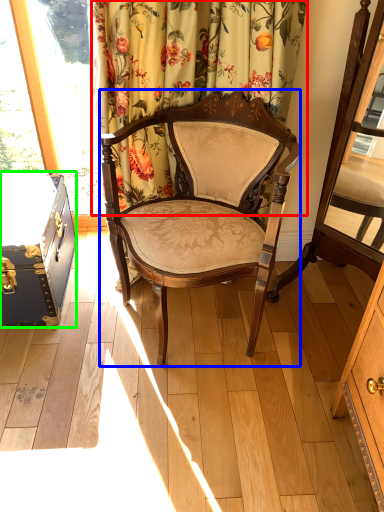
Question: Which is nearer to the curtain (highlighted by a red box)? chair (highlighted by a blue box) or box (highlighted by a green box).

Choices:
 (A) chair
 (B) box

Answer: (A)